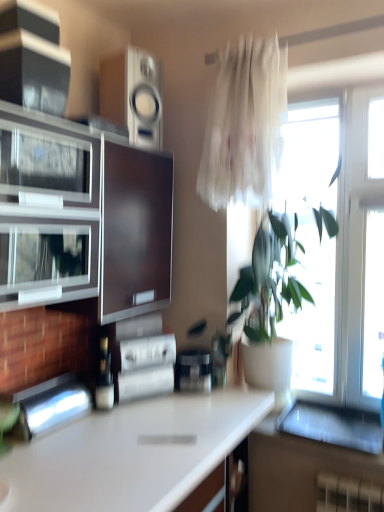
The image size is (384, 512). Identify the location of blank space above white glossy countertop at center (from a real-world perspective). (131, 435).